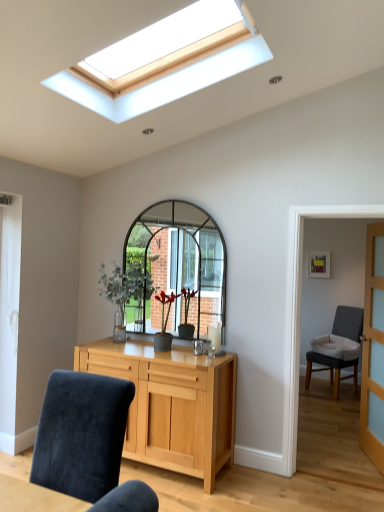
The height and width of the screenshot is (512, 384). I want to click on free space underneath green glass vase at center (from a real-world perspective), so pyautogui.click(x=112, y=342).